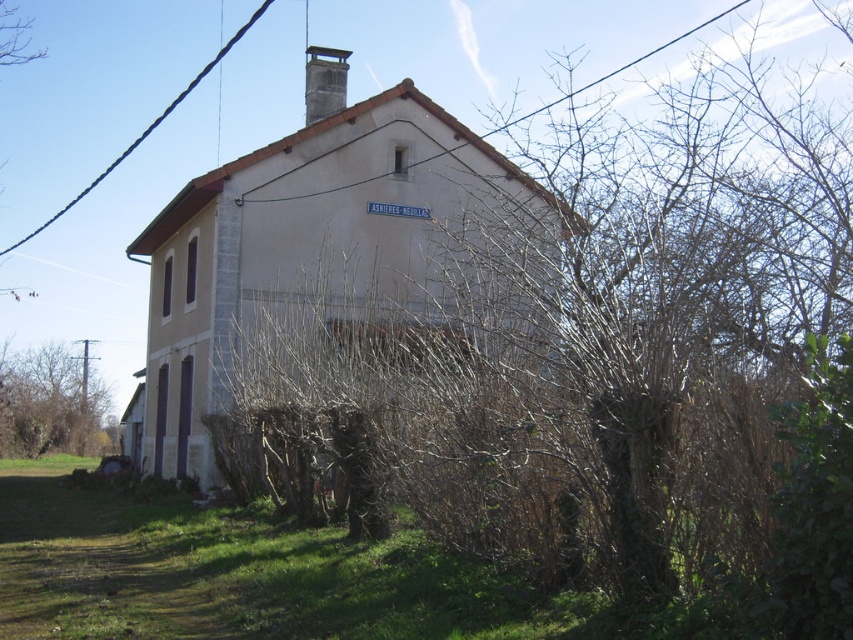
Question: Does brown dry bush at center appear under black wire at upper center?

Choices:
 (A) no
 (B) yes

Answer: (B)

Question: Which is nearer to the black wire at upper left?

Choices:
 (A) brown leafless tree at left
 (B) black wire at upper center
 (C) smooth gray chimney at upper center

Answer: (A)

Question: Which object appears closest to the camera in this image?

Choices:
 (A) smooth gray chimney at upper center
 (B) brown dry bush at center

Answer: (B)

Question: Can you confirm if black wire at upper center is positioned below black wire at upper left?

Choices:
 (A) yes
 (B) no

Answer: (A)

Question: Estimate the real-world distances between objects in this image. Which object is farther from the brown dry bush at center?

Choices:
 (A) smooth gray chimney at upper center
 (B) black wire at upper left
 (C) brown leafless tree at left
 (D) black wire at upper center

Answer: (B)

Question: Is brown dry bush at center wider than brown leafless tree at left?

Choices:
 (A) yes
 (B) no

Answer: (A)